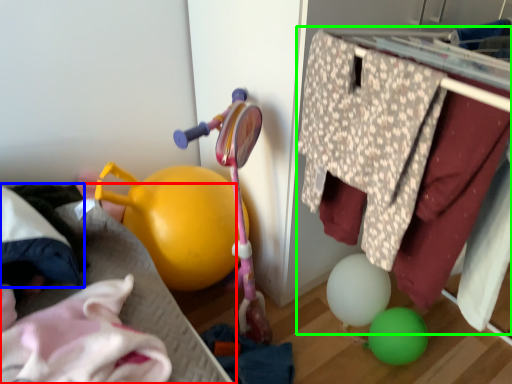
Question: Considering the real-world distances, which object is closest to bed frame (highlighted by a red box)? clothing (highlighted by a blue box) or closet (highlighted by a green box).

Choices:
 (A) clothing
 (B) closet

Answer: (A)